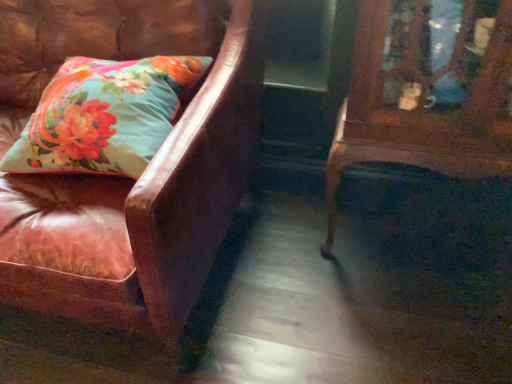
In order to click on free spot in front of mahogany wood side table at right in this screenshot , I will do `click(425, 322)`.